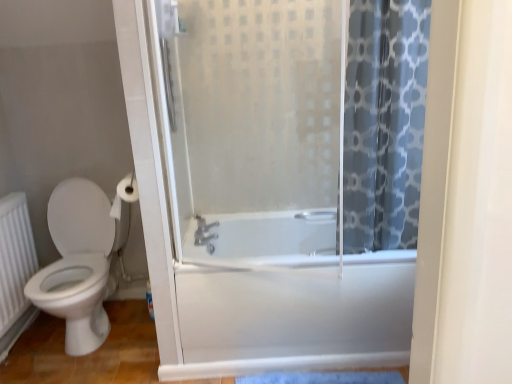
At what (x,y) coordinates should I click in order to perform the action: click on vacant space in white textured radiator at lower left (from a real-world perspective). Please return your answer as a coordinate pair (x, y). Image resolution: width=512 pixels, height=384 pixels. Looking at the image, I should click on (32, 331).